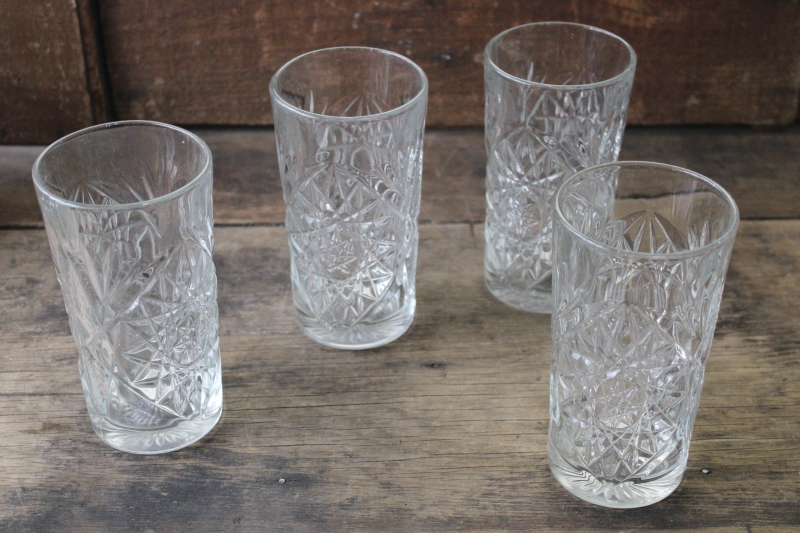
Find the location of a particular element. tabletop is located at coordinates (462, 423).